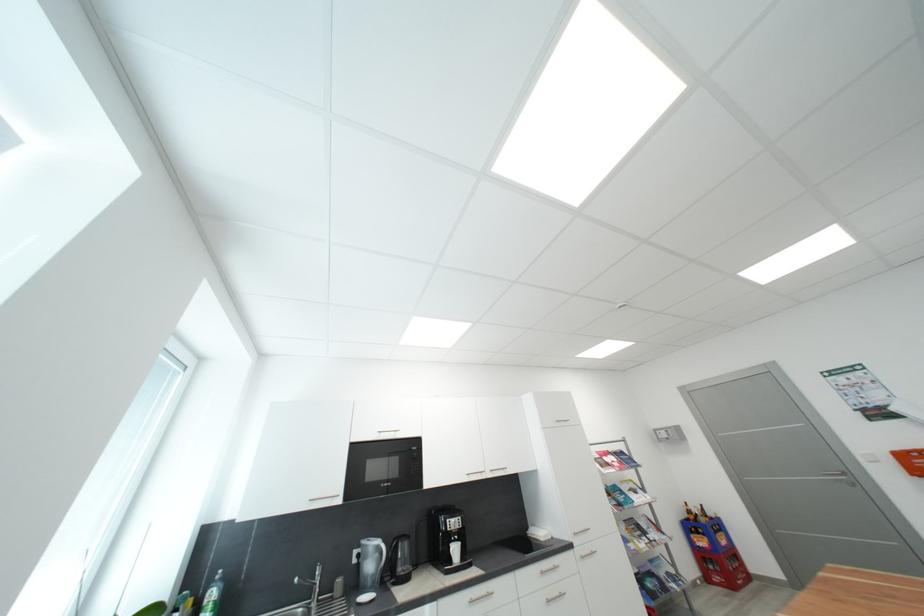
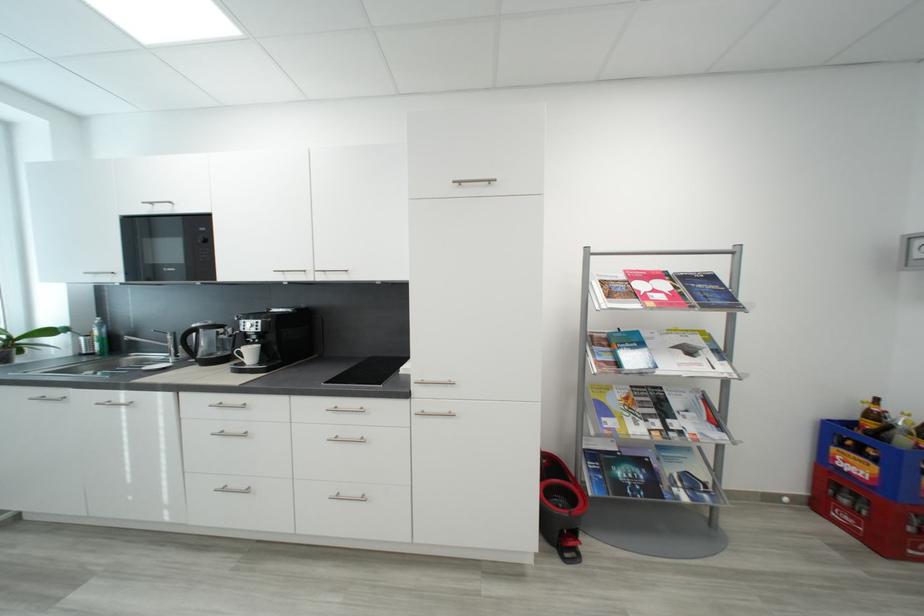
Where in the second image is the point corresponding to pixel 641 493 from the first image?

(697, 353)